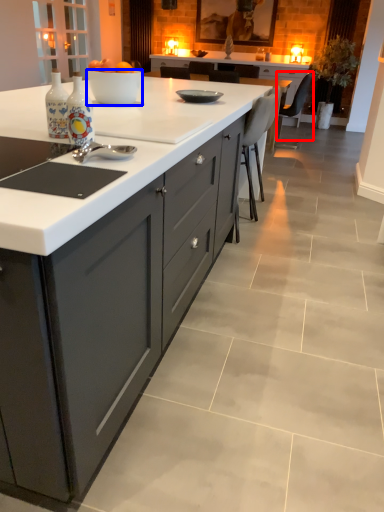
Question: Which object is further to the camera taking this photo, chair (highlighted by a red box) or bowl (highlighted by a blue box)?

Choices:
 (A) chair
 (B) bowl

Answer: (A)